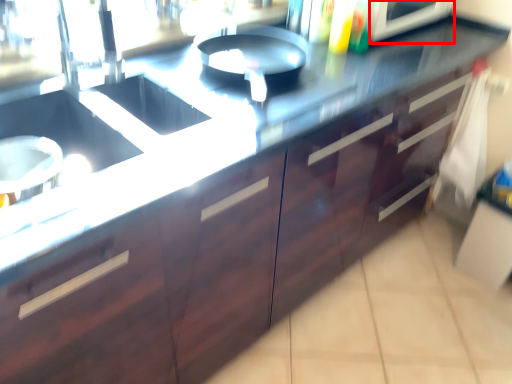
Question: Considering the relative positions of appliance (annotated by the red box) and drawer in the image provided, where is appliance (annotated by the red box) located with respect to the staircase?

Choices:
 (A) left
 (B) right

Answer: (A)